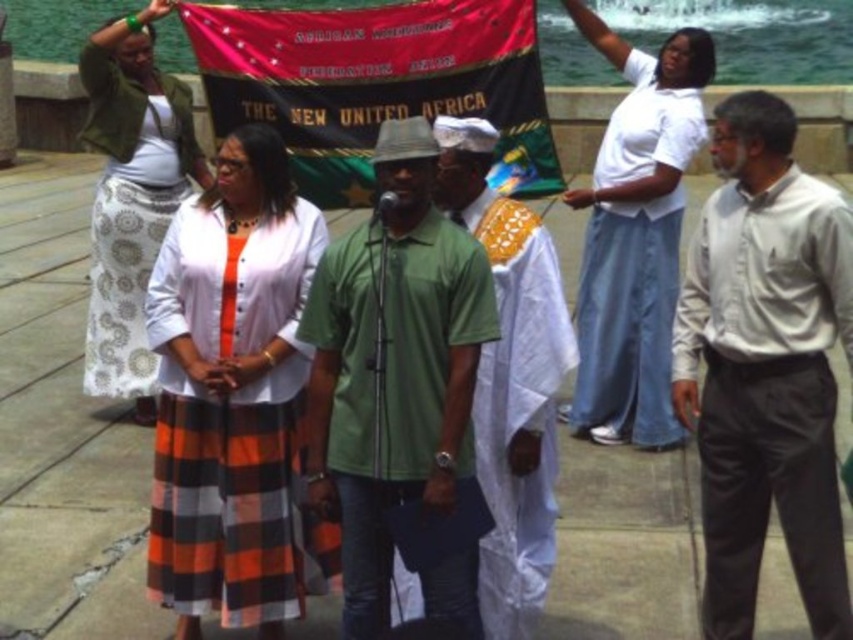
Which is below, gray cotton shirt at right or red fabric banner at center?

gray cotton shirt at right is below.

Does gray cotton shirt at right have a larger size compared to red fabric banner at center?

Actually, gray cotton shirt at right might be smaller than red fabric banner at center.

This screenshot has width=853, height=640. Find the location of `gray cotton shirt at right`. gray cotton shirt at right is located at coordinates click(x=764, y=368).

Is point (279, 618) in front of point (688, 115)?

Yes, point (279, 618) is in front of point (688, 115).

Which is more to the right, orange plaid skirt at center or white cotton shirt at upper right?

Positioned to the right is white cotton shirt at upper right.

Between point (238, 552) and point (624, 257), which one is positioned behind?

The point (624, 257) is more distant.

Find the location of a particular element. orange plaid skirt at center is located at coordinates (231, 392).

Is point (590, 419) less distant than point (155, 237)?

That is True.

The image size is (853, 640). I want to click on white cotton shirt at upper right, so click(635, 236).